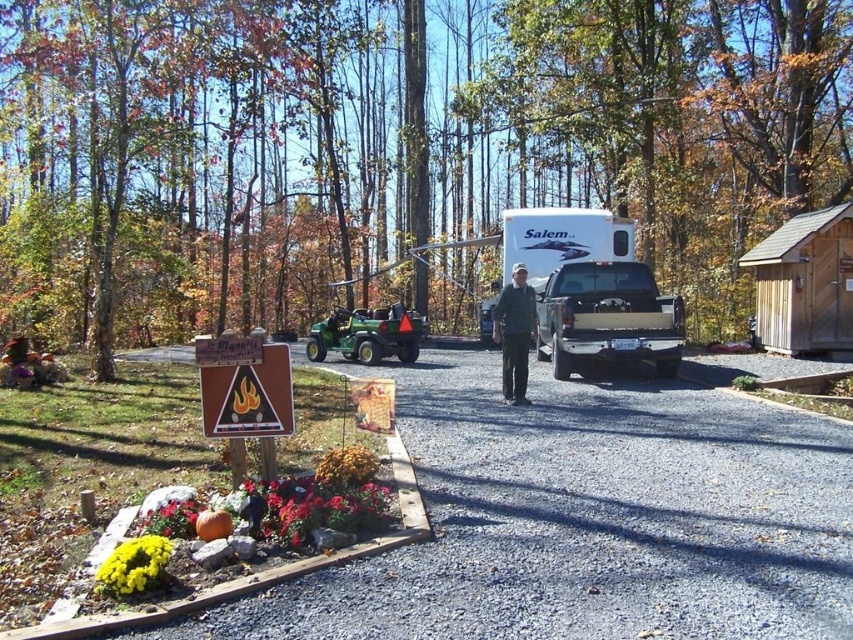
Based on the photo, you are a gardener who needs to decide whether to store the green plastic lawn mower at center and the dark gray jacket at center in a storage box that can only hold items up to the size of the larger object. Which object should you use to determine the maximum size for the storage box?

The dark gray jacket at center is larger than the green plastic lawn mower at center, so the storage box should be sized to accommodate the dark gray jacket at center.

You are a delivery person who needs to place a package on the ground between the green plastic lawn mower at center and the dark gray jacket at center. The package requires a minimum of 15 feet of space between it and any objects. Can you place the package there?

The green plastic lawn mower at center and dark gray jacket at center are 17.52 feet apart from each other. Since the required minimum space is 15 feet, the package can be placed between them as the distance is sufficient.

From the picture: You are standing at point (509, 304) and want to walk to the wooden planks bordering the garden. However, there is an obstacle at point (773, 253). Can you safely walk from your current position to the wooden planks without passing through the obstacle?

Point (773, 253) is behind point (509, 304), so you can safely walk from your current position to the wooden planks without passing through the obstacle.